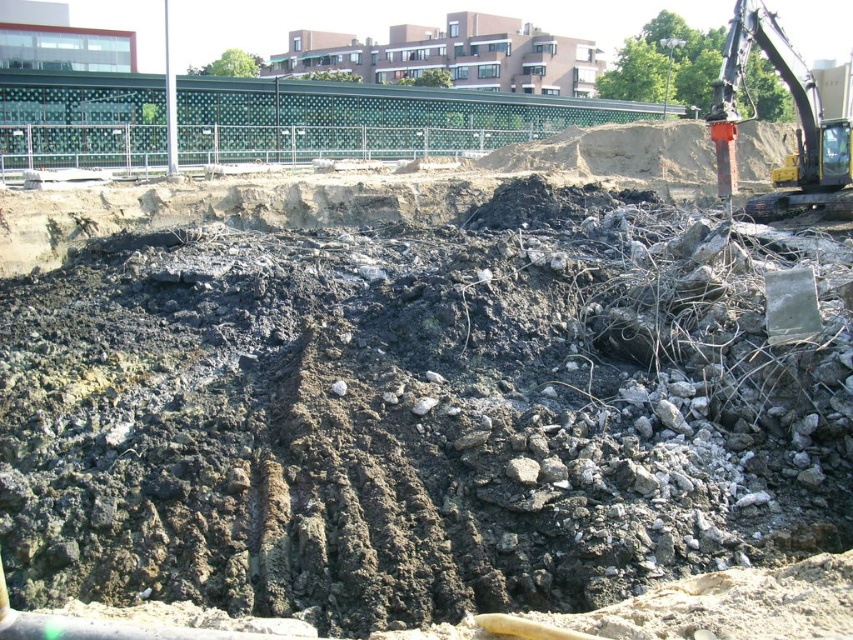
You are a construction worker who needs to move the yellow metallic excavator at upper right to the other side of the site. Considering the dull brown soil at center, which is an obstacle, can you safely move the excavator around it?

The dull brown soil at center is bigger than the yellow metallic excavator at upper right. Therefore, it is possible to move the excavator around the soil as it is smaller in size and the soil is larger, providing enough space to navigate around it.